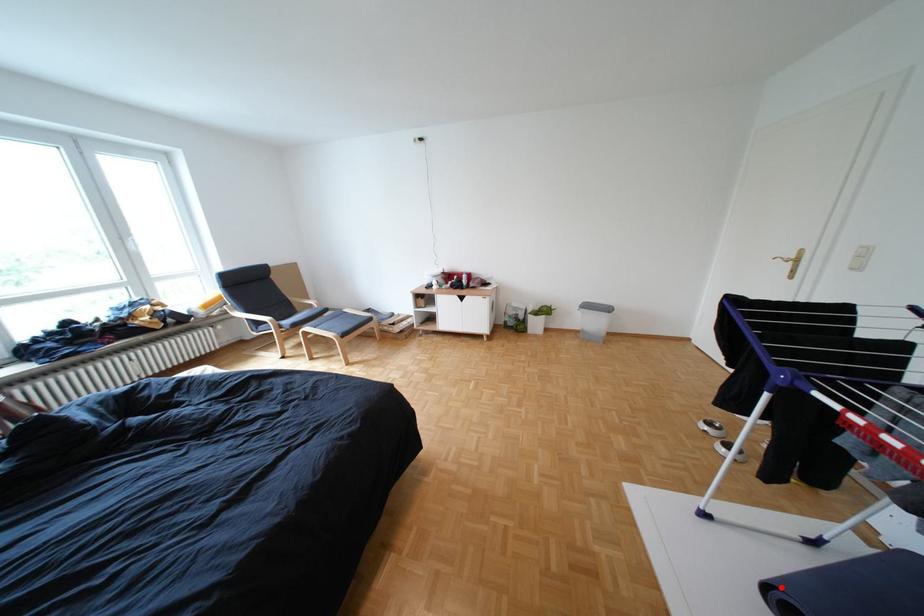
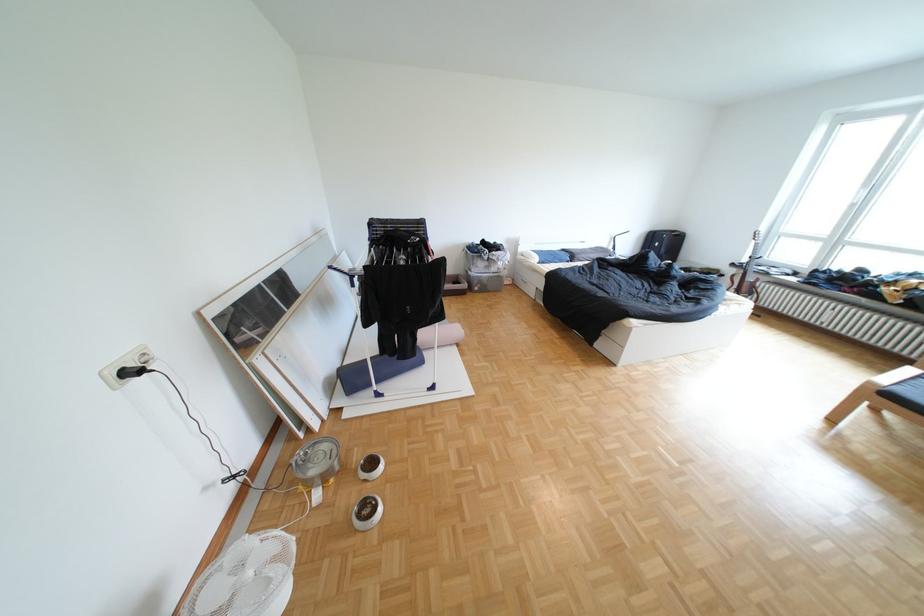
Question: I am providing you with two images of the same scene from different viewpoints. A red point is marked on the first image. Can you still see the location of the red point in image 2?

Choices:
 (A) Yes
 (B) No

Answer: (B)